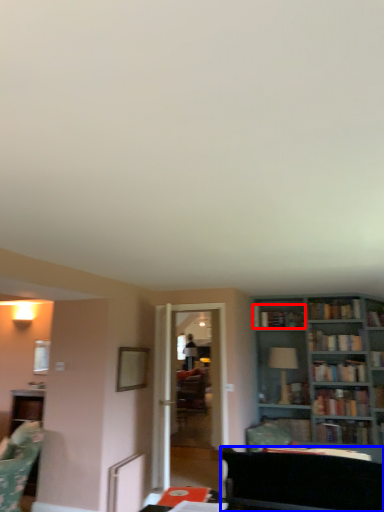
Question: Which object is further to the camera taking this photo, book (highlighted by a red box) or futon (highlighted by a blue box)?

Choices:
 (A) book
 (B) futon

Answer: (A)